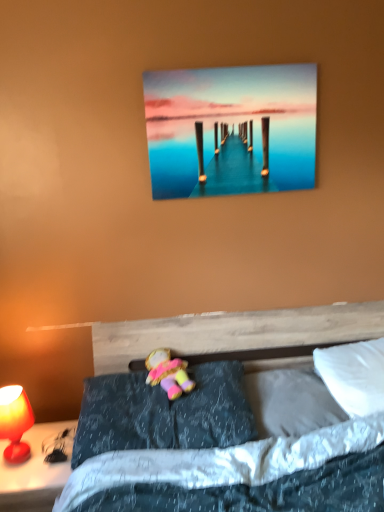
The image size is (384, 512). Find the location of `vacant area on top of matte red lamp at lower left (from a real-world perspective)`. vacant area on top of matte red lamp at lower left (from a real-world perspective) is located at coordinates (41, 451).